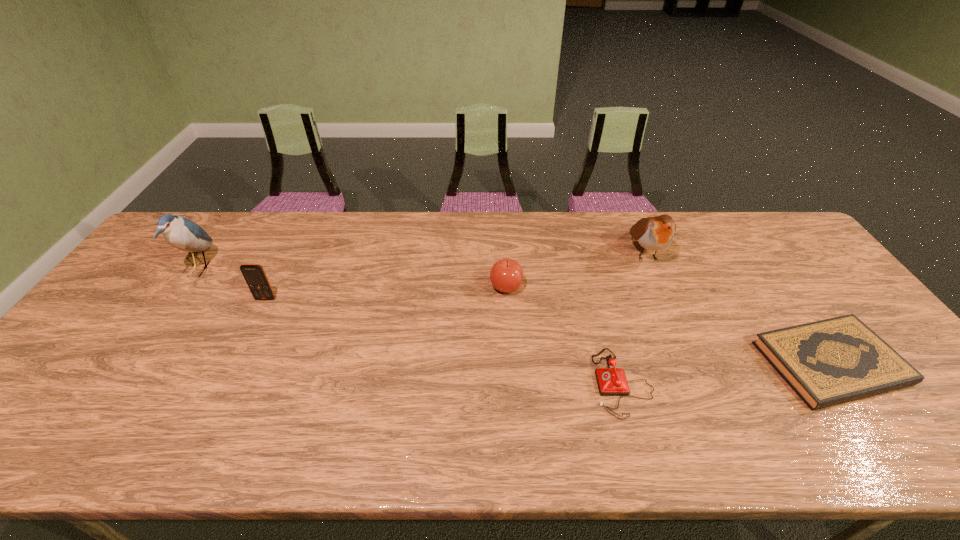
Where is `object at the right edge`? The image size is (960, 540). object at the right edge is located at coordinates [829, 362].

Find the location of a particular element. This screenshot has width=960, height=540. object that is at the far left corner is located at coordinates (181, 233).

The height and width of the screenshot is (540, 960). I want to click on vacant space at the far edge of the desktop, so click(x=525, y=235).

The width and height of the screenshot is (960, 540). What are the coordinates of `free space at the near edge of the desktop` in the screenshot? It's located at (841, 438).

This screenshot has height=540, width=960. I want to click on free space at the left edge of the desktop, so click(x=153, y=288).

Find the location of a particular element. This screenshot has height=540, width=960. free space at the right edge is located at coordinates 829,302.

Find the location of a particular element. The image size is (960, 540). vacant point at the far right corner is located at coordinates (739, 212).

The width and height of the screenshot is (960, 540). What are the coordinates of `blank area at the near right corner` in the screenshot? It's located at (900, 421).

Where is `vacant point located between the second object from left to right and the second shortest object`? This screenshot has height=540, width=960. vacant point located between the second object from left to right and the second shortest object is located at coordinates (444, 341).

Find the location of a particular element. Image resolution: width=960 pixels, height=540 pixels. vacant region between the leftmost object and the third object from right to left is located at coordinates (411, 326).